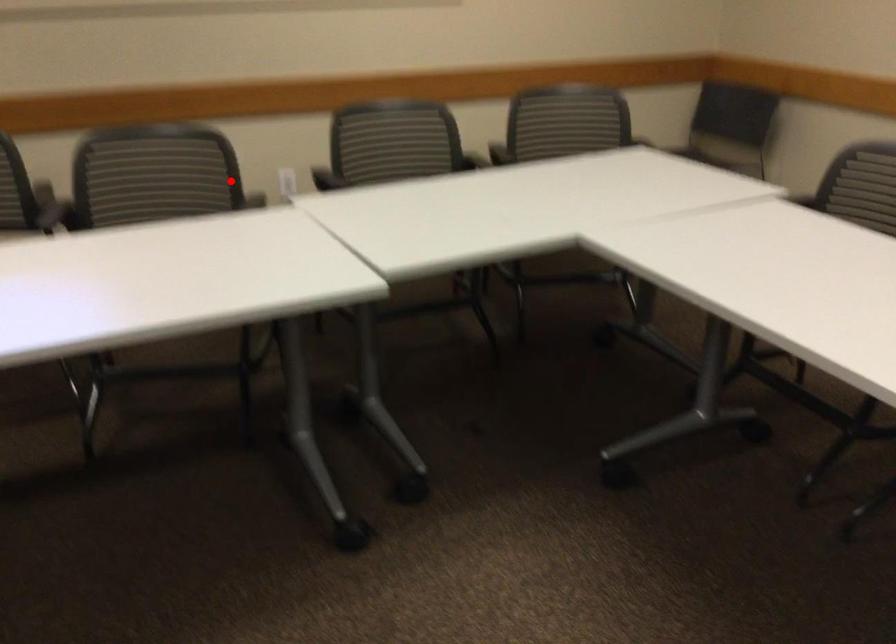
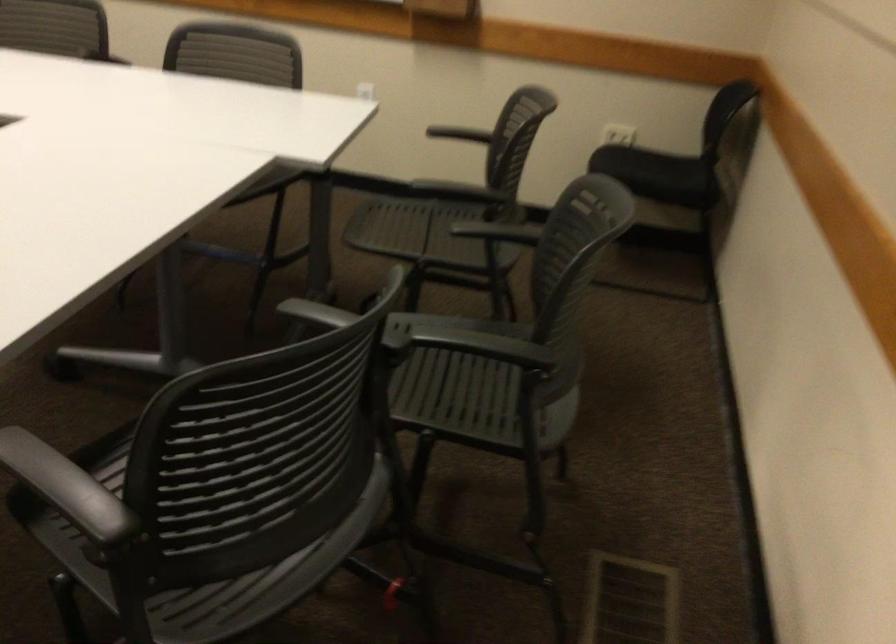
In the second image, find the point that corresponds to the highlighted location in the first image.

(141, 440)